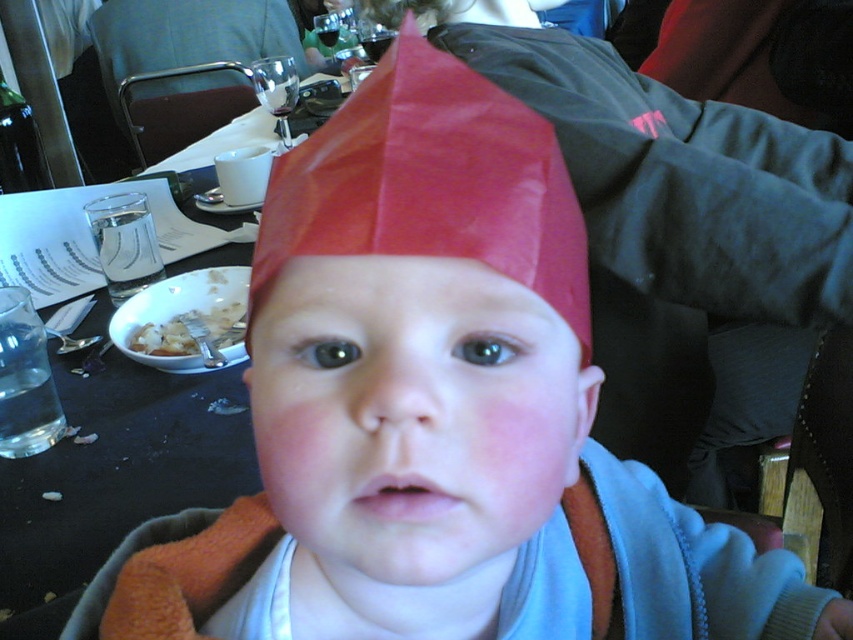
Question: Is the position of red paper hat at center more distant than that of white crumbly food at lower left?

Choices:
 (A) no
 (B) yes

Answer: (A)

Question: Does red paper hat at center appear on the right side of white crumbly food at lower left?

Choices:
 (A) no
 (B) yes

Answer: (B)

Question: Which point is closer to the camera?

Choices:
 (A) [474, 195]
 (B) [180, 346]

Answer: (A)

Question: Does red paper hat at center have a greater width compared to white crumbly food at lower left?

Choices:
 (A) yes
 (B) no

Answer: (B)

Question: Among these points, which one is farthest from the camera?

Choices:
 (A) (378, 93)
 (B) (216, 321)

Answer: (B)

Question: Among these objects, which one is farthest from the camera?

Choices:
 (A) red paper hat at center
 (B) white crumbly food at lower left

Answer: (B)